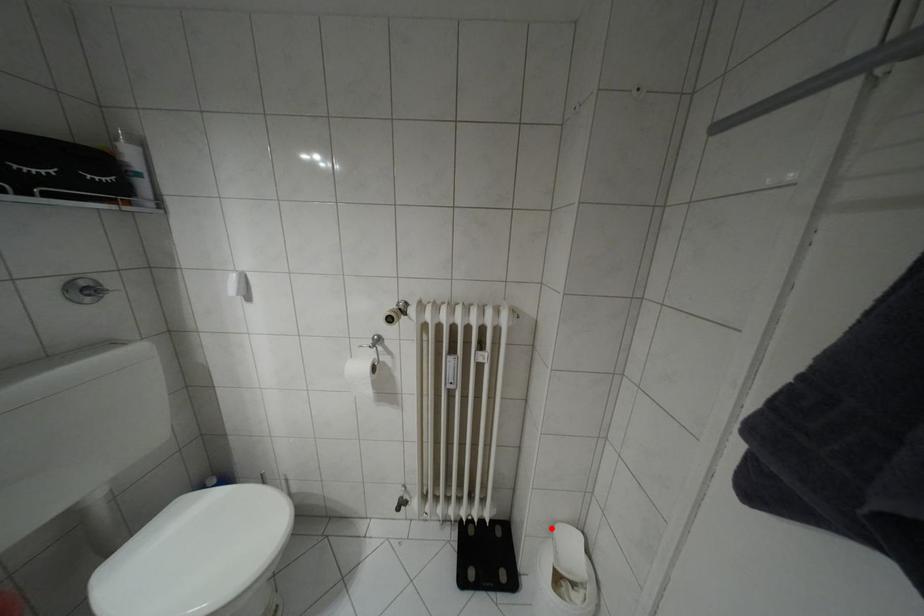
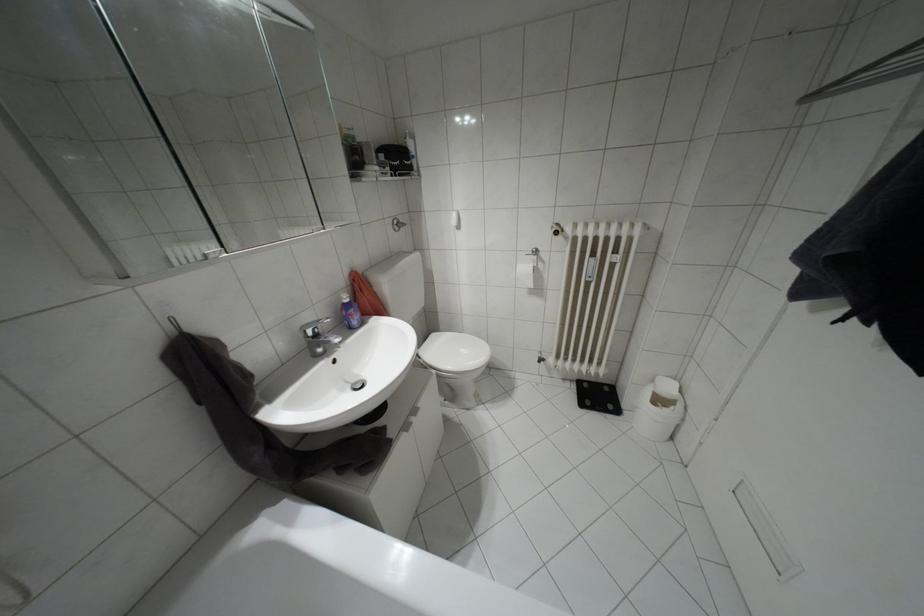
Where in the second image is the point corresponding to the highlighted location from the first image?

(652, 379)